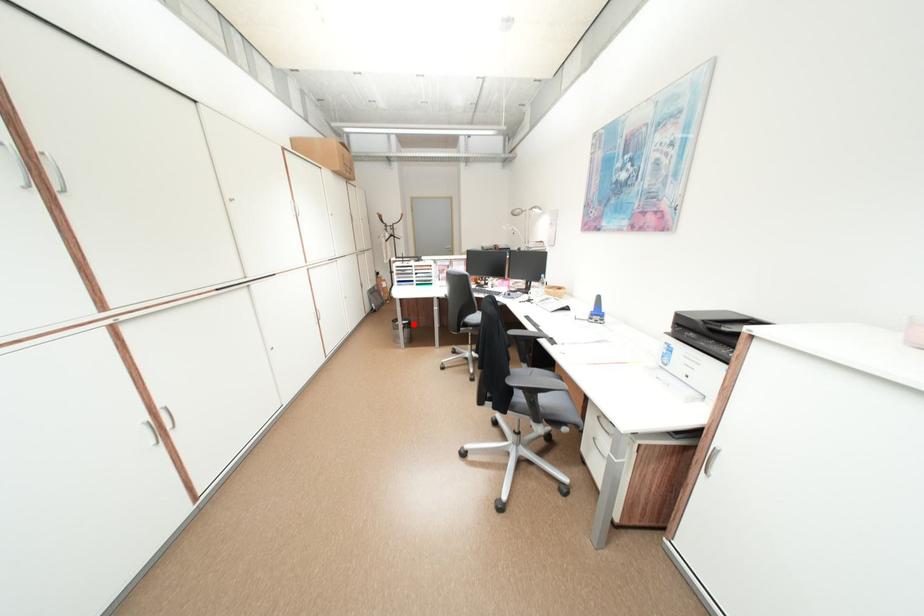
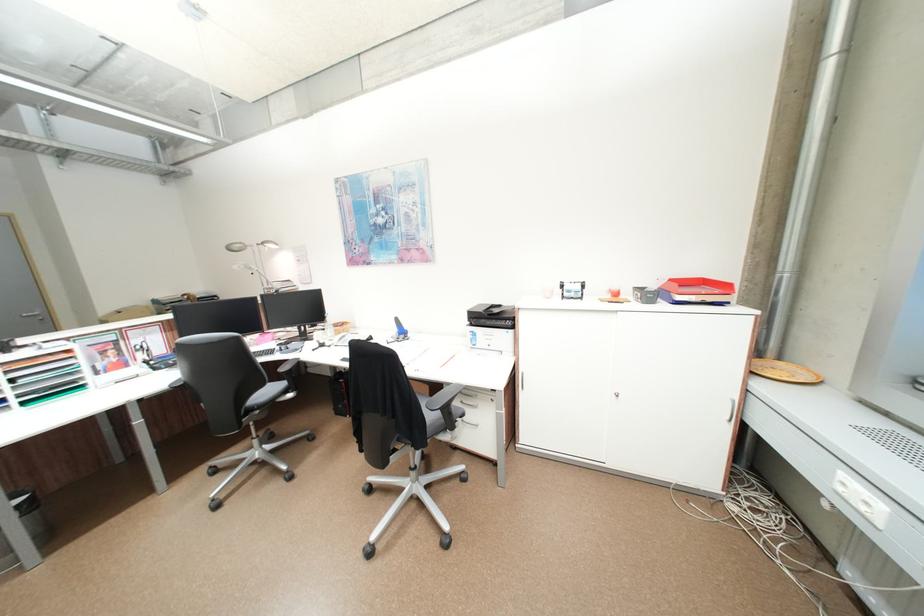
Question: I am providing you with two images of the same scene from different viewpoints. Image1 has a red point marked. In image2, the corresponding 3D location appears at what relative position? Reply with the corresponding letter.

Choices:
 (A) Closer
 (B) Farther

Answer: (A)